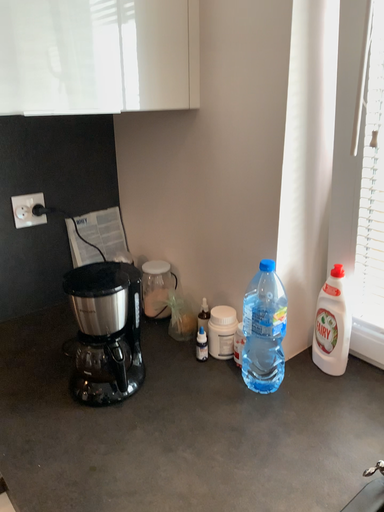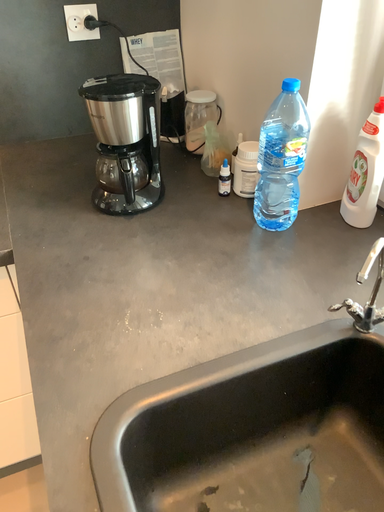
Question: How did the camera likely rotate when shooting the video?

Choices:
 (A) rotated upward
 (B) rotated downward

Answer: (B)